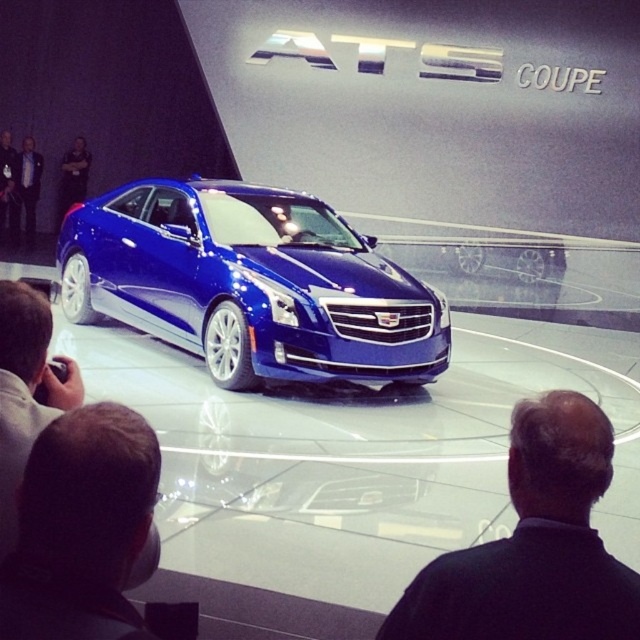
You are at the auto show and want to touch the black fabric coat at center located at point (532, 545). Can you reach it from your current position?

The black fabric coat at center is located at point (532, 545), so yes, you can reach it from your current position as it is within your reach.